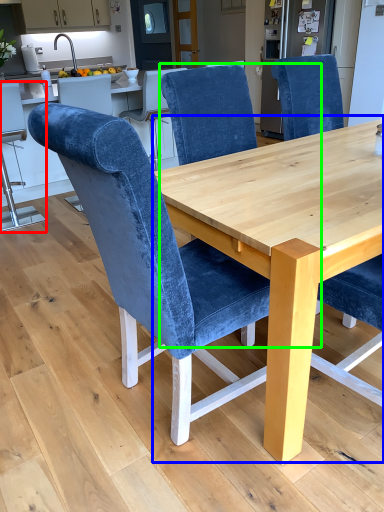
Question: Which object is the farthest from chair (highlighted by a red box)? Choose among these: round table (highlighted by a blue box) or chair (highlighted by a green box).

Choices:
 (A) round table
 (B) chair

Answer: (A)